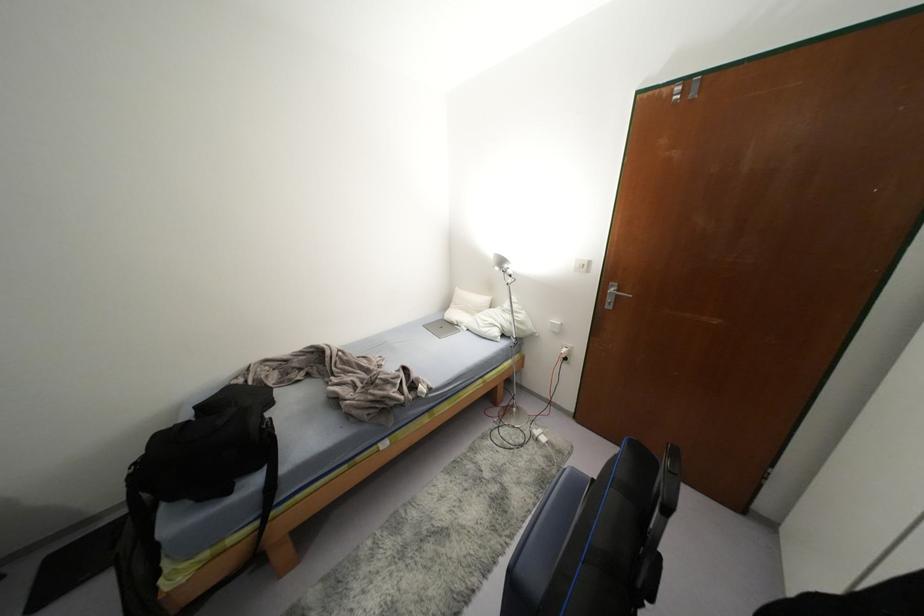
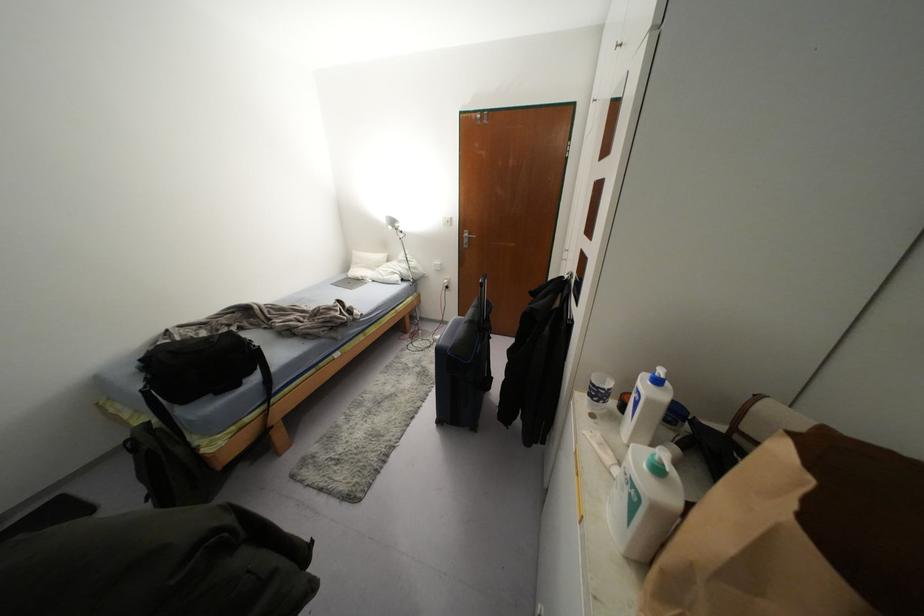
Locate, in the second image, the point that corresponds to the point at 452,325 in the first image.

(358, 281)